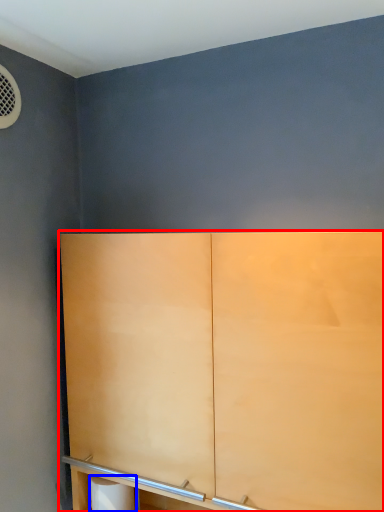
Question: Which of the following is the closest to the observer, cupboard (highlighted by a red box) or toilet paper (highlighted by a blue box)?

Choices:
 (A) cupboard
 (B) toilet paper

Answer: (A)